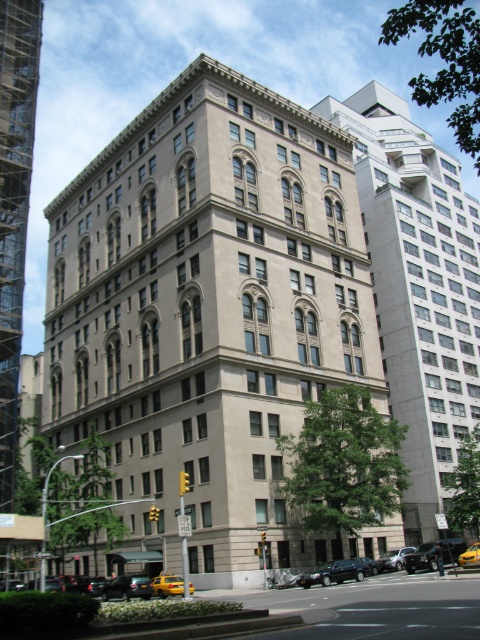
Question: Which is nearer to the shiny silver sedan at center?

Choices:
 (A) yellow matte taxi cab at lower center
 (B) shiny black sedan at lower center
 (C) black matte car at lower left

Answer: (A)

Question: Can you confirm if black matte car at lower left is positioned to the right of yellow rubber taxi at lower center?

Choices:
 (A) yes
 (B) no

Answer: (B)

Question: Which object is positioned farthest from the yellow rubber taxi at lower center?

Choices:
 (A) black matte car at lower left
 (B) shiny silver sedan at center

Answer: (B)

Question: Is shiny black sedan at lower center positioned in front of yellow rubber taxi at lower center?

Choices:
 (A) no
 (B) yes

Answer: (A)

Question: Is shiny black sedan at lower center further to camera compared to yellow matte taxi cab at lower center?

Choices:
 (A) yes
 (B) no

Answer: (A)

Question: Which object is farther from the camera taking this photo?

Choices:
 (A) yellow rubber taxi at lower center
 (B) yellow matte taxi cab at lower center
 (C) shiny black sedan at lower center
 (D) shiny silver sedan at center

Answer: (D)